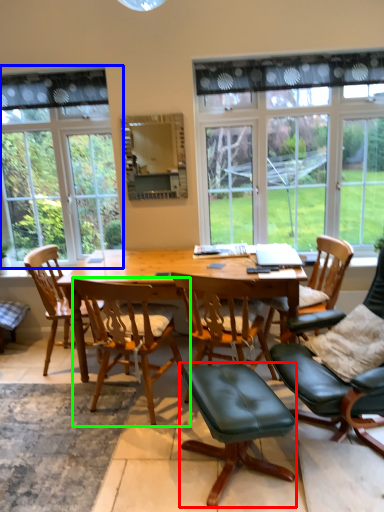
Question: Estimate the real-world distances between objects in this image. Which object is closer to stool (highlighted by a red box), window (highlighted by a blue box) or chair (highlighted by a green box)?

Choices:
 (A) window
 (B) chair

Answer: (B)